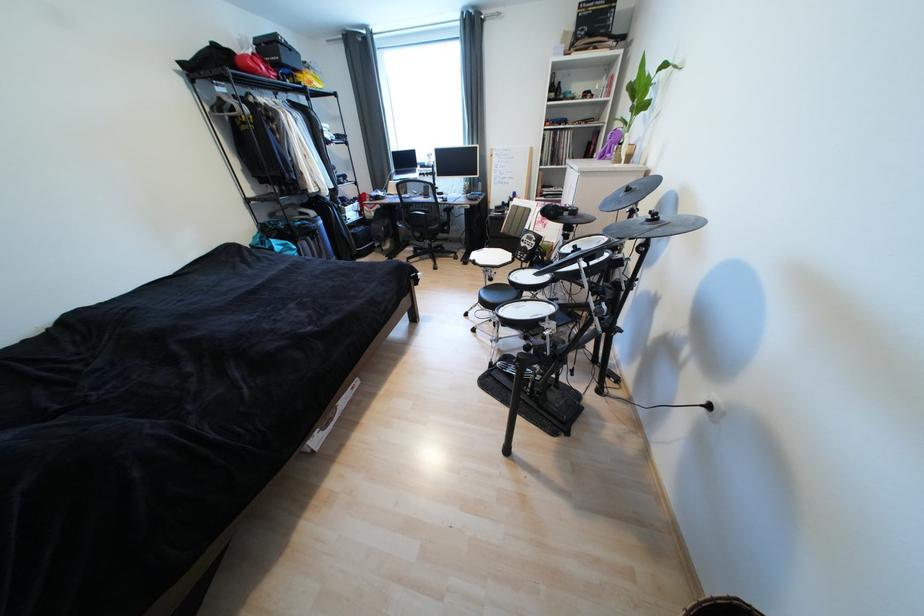
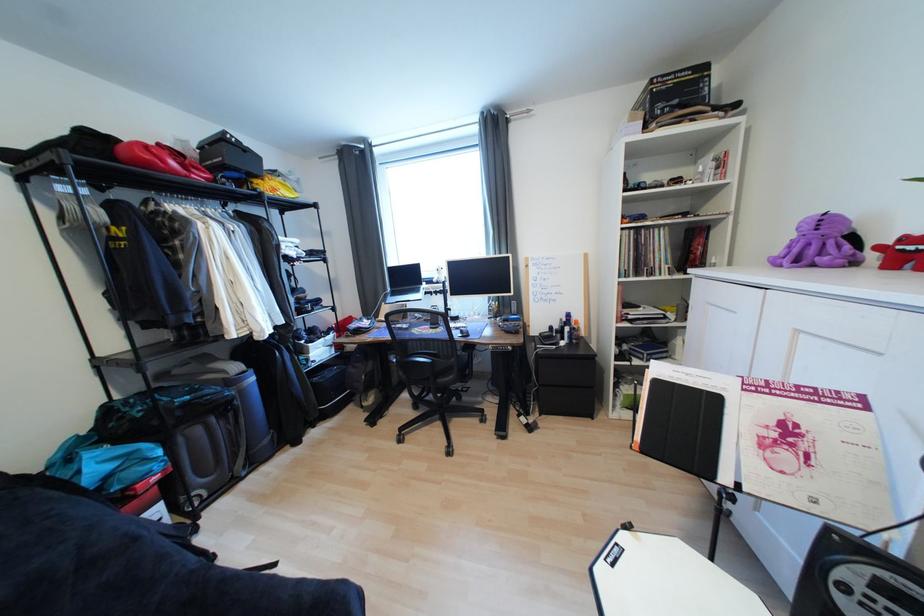
Question: The images are taken continuously from a first-person perspective. In which direction are you moving?

Choices:
 (A) Left
 (B) Right
 (C) Forward
 (D) Backward

Answer: (C)